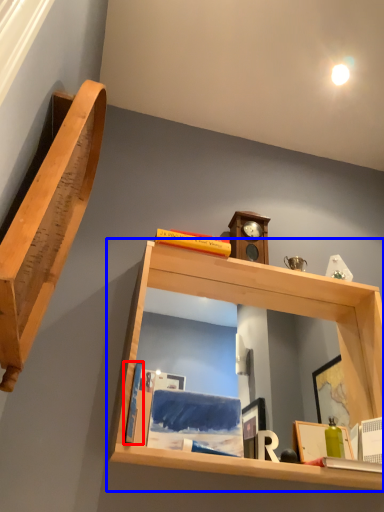
Question: Which point is further to the camera, book (highlighted by a red box) or shelf (highlighted by a blue box)?

Choices:
 (A) book
 (B) shelf

Answer: (A)